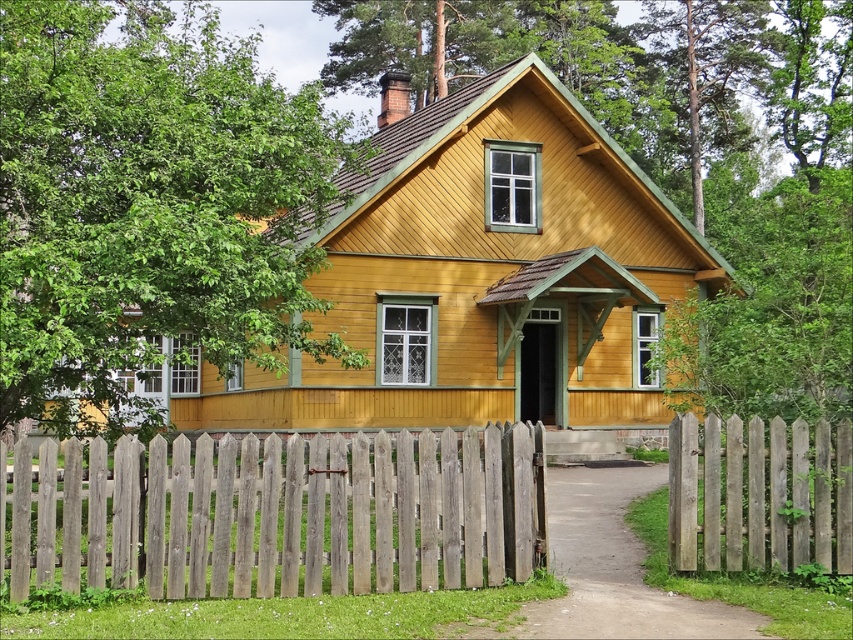
Is yellow wooden cottage at center wider than weathered wood fence at center?

Indeed, yellow wooden cottage at center has a greater width compared to weathered wood fence at center.

Is yellow wooden cottage at center bigger than weathered wood fence at center?

Yes, yellow wooden cottage at center is bigger than weathered wood fence at center.

Is point (202, 426) farther from viewer compared to point (126, 467)?

Yes, it is.

The width and height of the screenshot is (853, 640). I want to click on yellow wooden cottage at center, so click(x=482, y=275).

Locate an element on the screen. The image size is (853, 640). green leafy tree at upper left is located at coordinates (149, 205).

Is point (44, 396) farther from camera compared to point (181, 596)?

Yes, point (44, 396) is farther from viewer.

Identify the location of green leafy tree at upper left. (149, 205).

Does green leafy tree at upper left have a lesser width compared to yellow wooden cottage at center?

No, green leafy tree at upper left is not thinner than yellow wooden cottage at center.

Does green leafy tree at upper left have a lesser height compared to yellow wooden cottage at center?

No.

This screenshot has width=853, height=640. Identify the location of green leafy tree at upper left. (149, 205).

I want to click on green leafy tree at upper left, so click(149, 205).